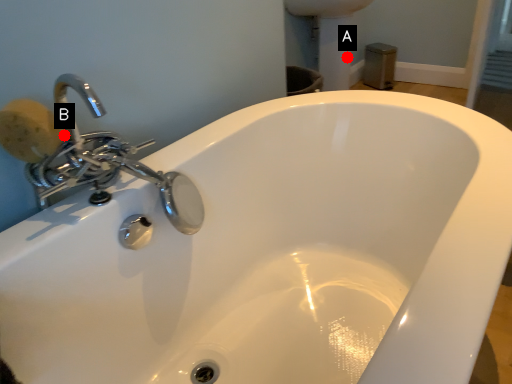
Question: Two points are circled on the image, labeled by A and B beside each circle. Which point appears farthest from the camera in this image?

Choices:
 (A) A is further
 (B) B is further

Answer: (A)